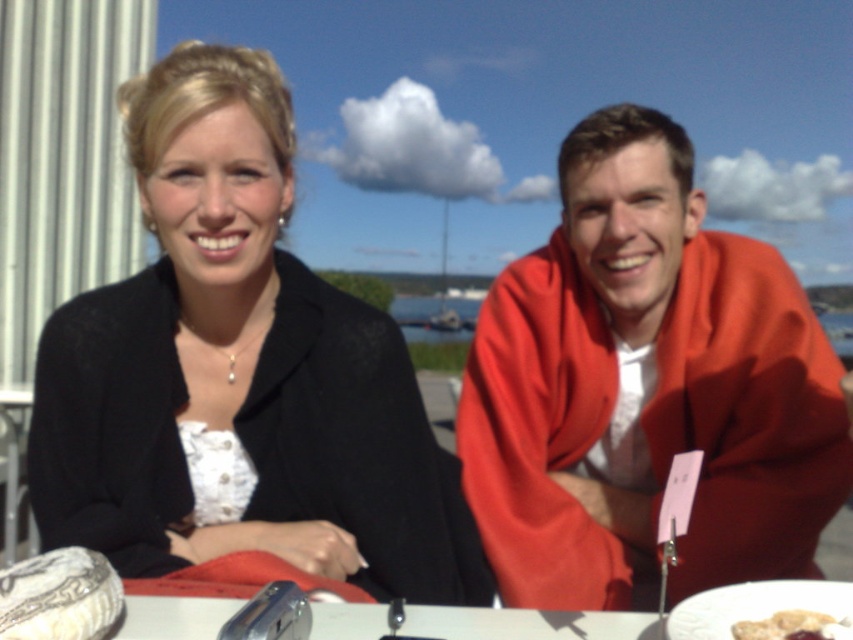
Question: Does matte red jacket at center lie in front of white ceramic plate at lower right?

Choices:
 (A) yes
 (B) no

Answer: (B)

Question: Can you confirm if matte red jacket at center is smaller than white ceramic plate at lower right?

Choices:
 (A) no
 (B) yes

Answer: (A)

Question: Which of the following is the closest to the observer?

Choices:
 (A) (728, 410)
 (B) (805, 596)
 (C) (798, 632)
 (D) (151, 460)

Answer: (C)

Question: In this image, where is matte red jacket at center located relative to white ceramic plate at lower right?

Choices:
 (A) left
 (B) right

Answer: (B)

Question: Among these points, which one is farthest from the camera?

Choices:
 (A) (778, 625)
 (B) (666, 627)
 (C) (769, 554)

Answer: (C)

Question: Considering the real-world distances, which object is closest to the black matte blazer at center?

Choices:
 (A) smooth white bread at lower right
 (B) matte red jacket at center

Answer: (B)